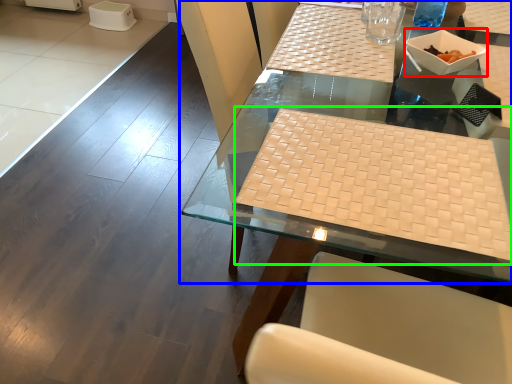
Question: Which object is the farthest from bowl (highlighted by a red box)? Choose among these: table (highlighted by a blue box) or wide (highlighted by a green box).

Choices:
 (A) table
 (B) wide

Answer: (B)